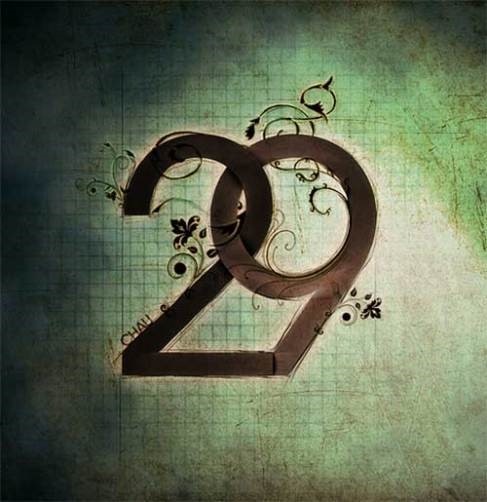
Locate an element on the screen. painting is located at coordinates (414, 237).